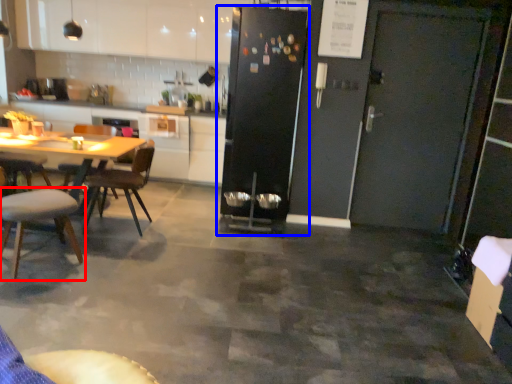
Question: Which object appears closest to the camera in this image, chair (highlighted by a red box) or refrigerator (highlighted by a blue box)?

Choices:
 (A) chair
 (B) refrigerator

Answer: (A)